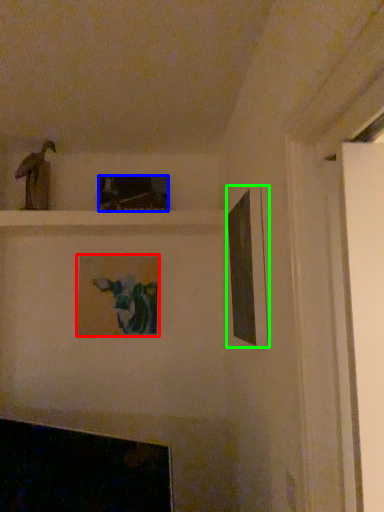
Question: Estimate the real-world distances between objects in this image. Which object is closer to picture frame (highlighted by a red box), picture frame (highlighted by a blue box) or picture frame (highlighted by a green box)?

Choices:
 (A) picture frame
 (B) picture frame

Answer: (A)